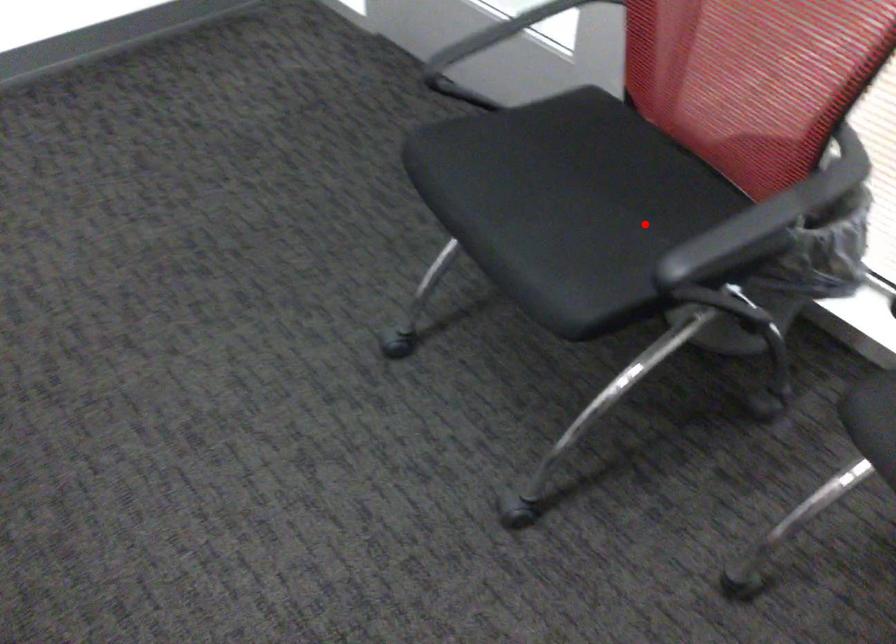
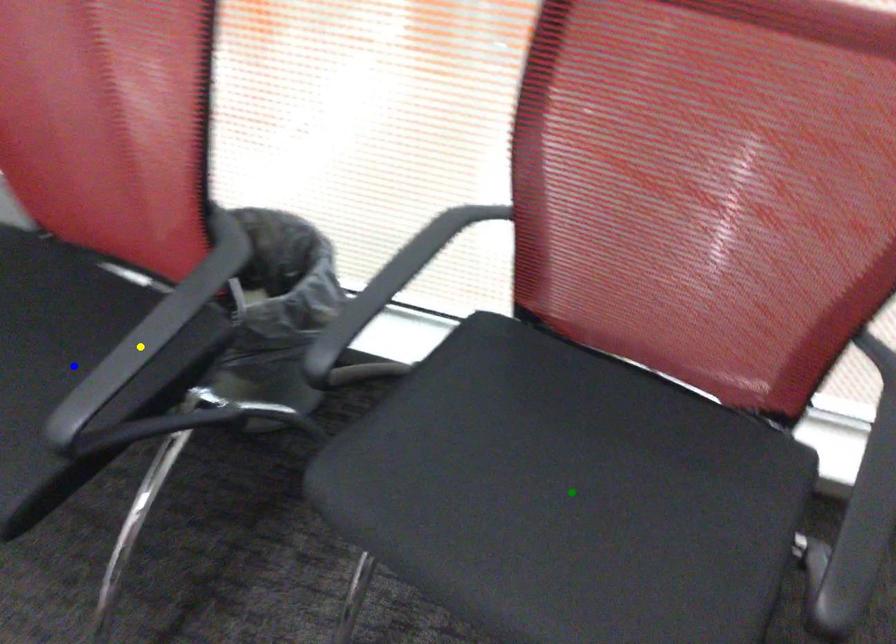
Question: I am providing you with two images of the same scene from different viewpoints. A red point is marked on the first image. You are given multiple points on the second image. Which spot in image 2 lines up with the point in image 1?

Choices:
 (A) green point
 (B) blue point
 (C) yellow point

Answer: (B)